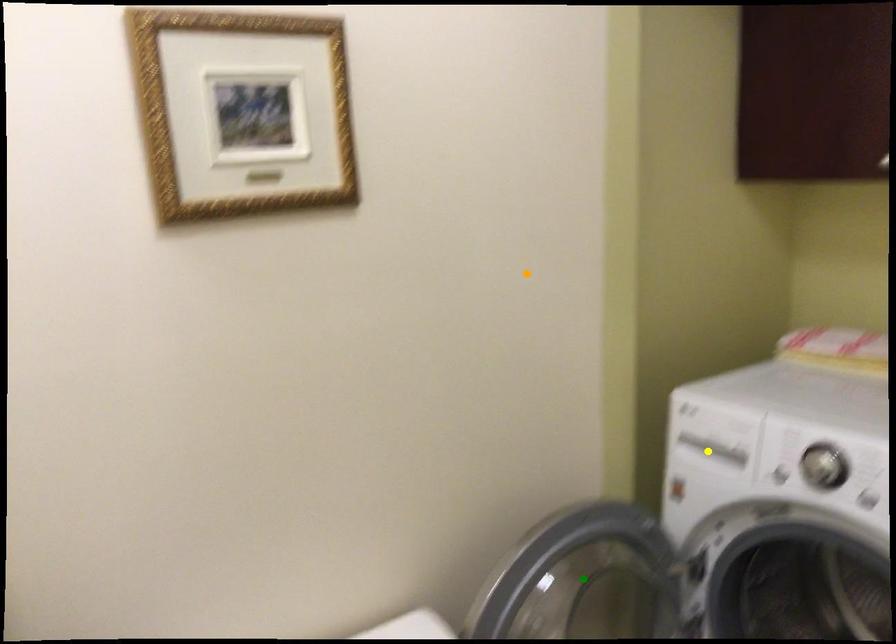
Order these from nearest to farthest:
green point, orange point, yellow point

orange point → green point → yellow point